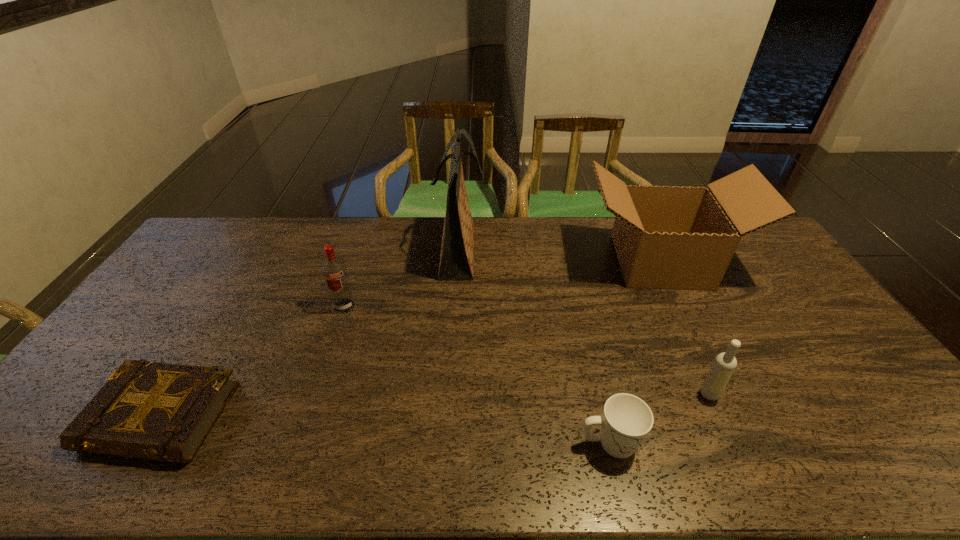
Identify the location of the tallest object. (457, 249).

At what (x,y) coordinates should I click in order to perform the action: click on the third object from left to right. Please return your answer as a coordinate pair (x, y). This screenshot has height=540, width=960. Looking at the image, I should click on (457, 249).

At what (x,y) coordinates should I click in order to perform the action: click on box. Please return your answer as a coordinate pair (x, y). Image resolution: width=960 pixels, height=540 pixels. Looking at the image, I should click on (666, 237).

Find the location of a particular element. The image size is (960, 540). the second object from left to right is located at coordinates (334, 270).

At what (x,y) coordinates should I click in order to perform the action: click on the third farthest object. Please return your answer as a coordinate pair (x, y). The width and height of the screenshot is (960, 540). Looking at the image, I should click on (334, 270).

I want to click on the shorter vodka, so click(x=725, y=363).

This screenshot has width=960, height=540. Find the location of `the nearer vodka`. the nearer vodka is located at coordinates (725, 363).

At what (x,y) coordinates should I click in order to perform the action: click on mug. Please return your answer as a coordinate pair (x, y). The width and height of the screenshot is (960, 540). Looking at the image, I should click on (626, 421).

You are a GUI agent. You are given a task and a screenshot of the screen. Output one action in this format:
    pyautogui.click(x=<x>, y=<y>)
    Task: Click on the hardback book
    This screenshot has height=540, width=960.
    Given the screenshot: What is the action you would take?
    pyautogui.click(x=155, y=411)

At what (x,y) coordinates should I click in order to perform the action: click on the shortest object. Please return your answer as a coordinate pair (x, y). Looking at the image, I should click on (155, 411).